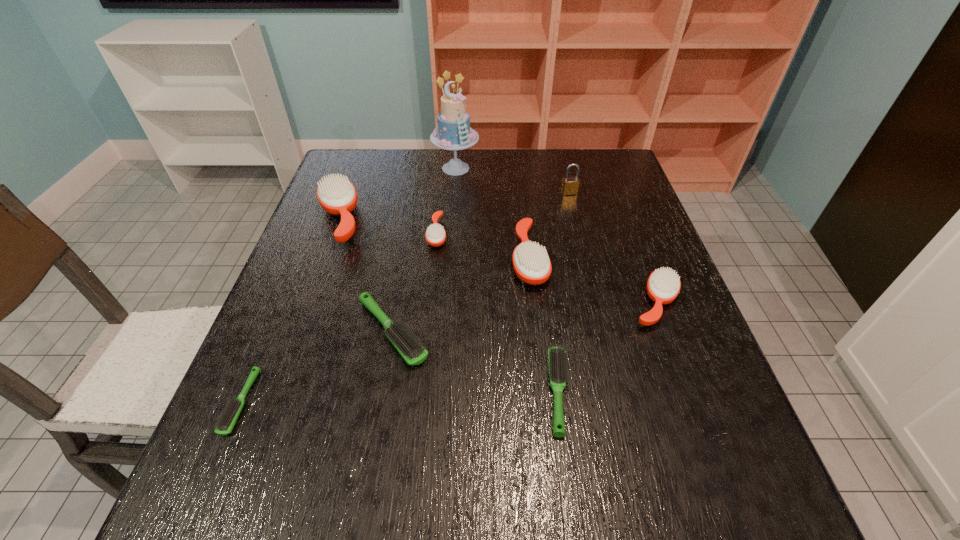
The height and width of the screenshot is (540, 960). Find the location of `the second light hairbrush from left to right`. the second light hairbrush from left to right is located at coordinates (410, 348).

Locate an element on the screen. The height and width of the screenshot is (540, 960). the third orange hairbrush from right to left is located at coordinates (435, 235).

At what (x,y) coordinates should I click in order to perform the action: click on the second shortest hairbrush. Please return your answer as a coordinate pair (x, y). Looking at the image, I should click on (558, 367).

This screenshot has height=540, width=960. Identify the location of the second smallest light hairbrush. (558, 367).

The width and height of the screenshot is (960, 540). In order to click on the smallest light hairbrush in this screenshot , I will do `click(229, 415)`.

At what (x,y) coordinates should I click in order to perform the action: click on the shortest object. Please return your answer as a coordinate pair (x, y). The height and width of the screenshot is (540, 960). Looking at the image, I should click on (229, 415).

The width and height of the screenshot is (960, 540). I want to click on free space located with a ladder on the side of the tallest object, so click(x=454, y=192).

What are the coordinates of `free location located on the front of the padlock` in the screenshot? It's located at (588, 268).

Find the location of a particular element. The image size is (960, 540). vacant position located on the right of the seventh shortest object is located at coordinates (508, 219).

The width and height of the screenshot is (960, 540). In order to click on free space located 0.290m on the left of the second tallest hairbrush in this screenshot , I will do `click(394, 259)`.